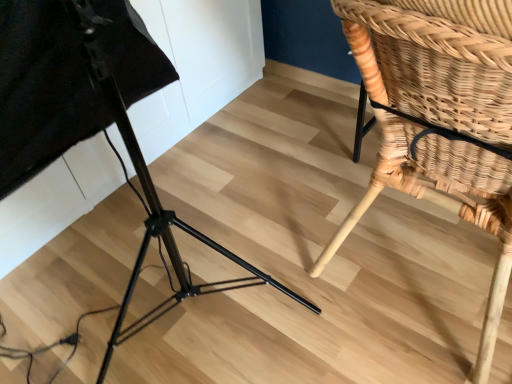
This screenshot has height=384, width=512. Find the location of `free space below black metal tripod at lower left (from a real-world perspective)`. free space below black metal tripod at lower left (from a real-world perspective) is located at coordinates [172, 287].